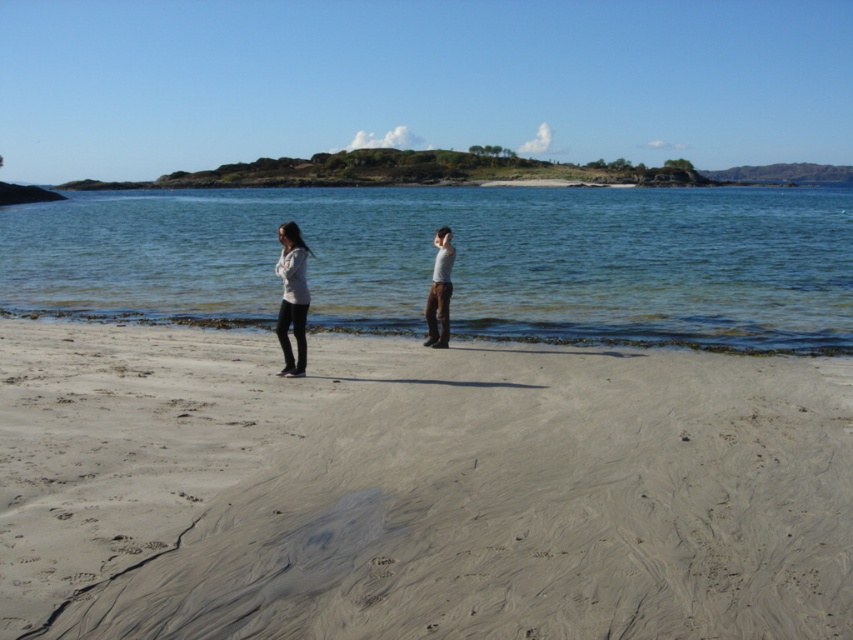
Does point (289, 285) lie in front of point (445, 250)?

That is True.

Is point (294, 234) positioned behind point (442, 253)?

No, it is not.

What do you see at coordinates (292, 298) in the screenshot? This screenshot has height=640, width=853. I see `matte gray sweater at center` at bounding box center [292, 298].

The image size is (853, 640). I want to click on matte gray sweater at center, so click(x=292, y=298).

Is clear water at center further to camera compared to light gray cotton shirt at center?

No, clear water at center is closer to the viewer.

Is point (329, 253) positioned before point (448, 262)?

That is False.

Identify the location of clear water at center. (456, 260).

Who is more distant from viewer, [648,413] or [285,300]?

Positioned behind is point [285,300].

Does smooth sand at center have a lesser width compared to matte gray sweater at center?

No.

Which is behind, point (583, 396) or point (291, 275)?

The point (291, 275) is behind.

The width and height of the screenshot is (853, 640). What are the coordinates of `smooth sand at center` in the screenshot? It's located at (416, 490).